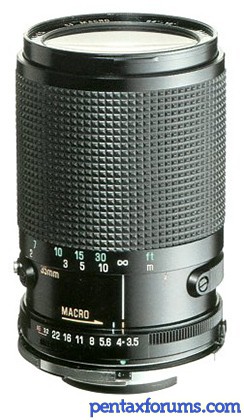
Image resolution: width=244 pixels, height=420 pixels. Identify the location of glass. (138, 41).